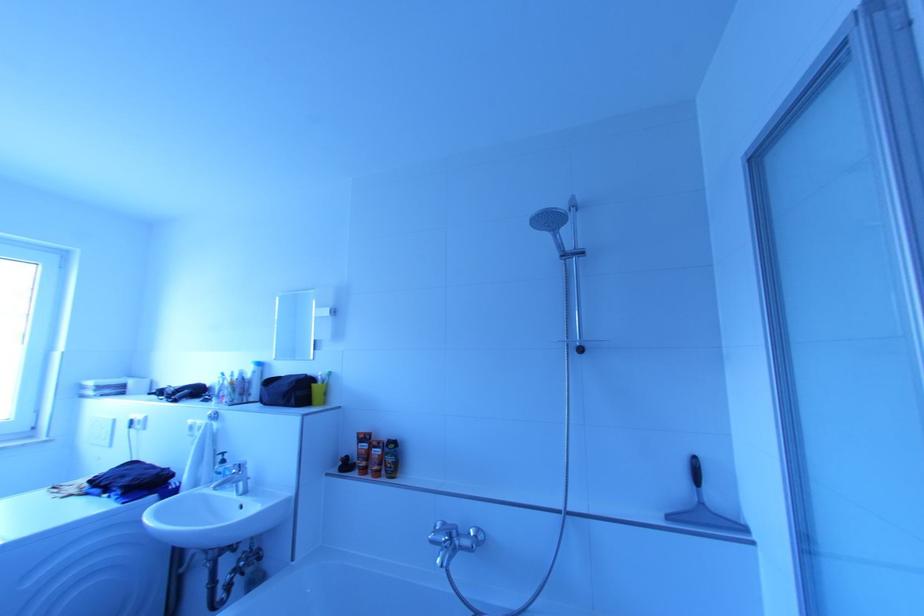
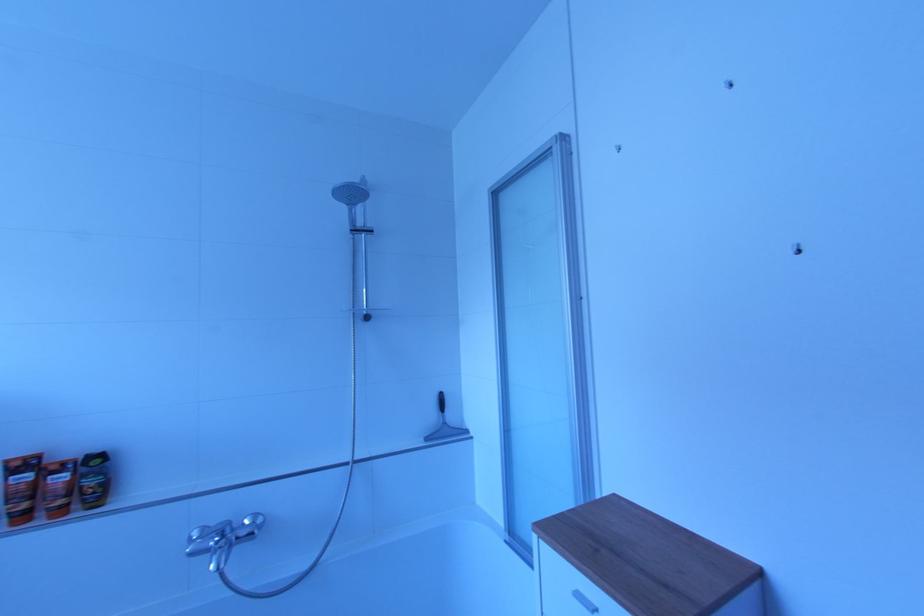
Question: The camera is either moving clockwise (left) or counter-clockwise (right) around the object. The first image is from the beginning of the video and the second image is from the end. Is the camera moving left or right when shooting the video?

Choices:
 (A) Left
 (B) Right

Answer: (A)